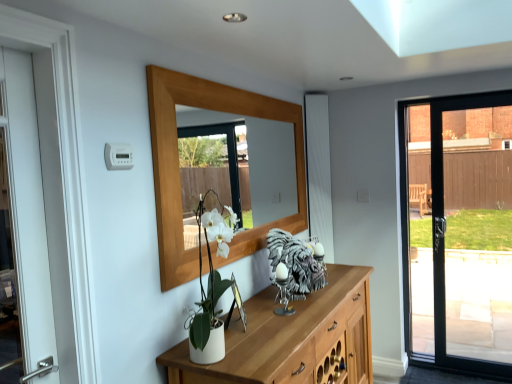
Question: From the image's perspective, is shiny silver sculpture at center beneath wooden mirror at upper center?

Choices:
 (A) no
 (B) yes

Answer: (B)

Question: Is shiny silver sculpture at center closer to camera compared to wooden mirror at upper center?

Choices:
 (A) yes
 (B) no

Answer: (B)

Question: Does shiny silver sculpture at center contain wooden mirror at upper center?

Choices:
 (A) no
 (B) yes

Answer: (A)

Question: Can you confirm if shiny silver sculpture at center is wider than wooden mirror at upper center?

Choices:
 (A) yes
 (B) no

Answer: (A)

Question: Is shiny silver sculpture at center touching wooden mirror at upper center?

Choices:
 (A) yes
 (B) no

Answer: (B)

Question: Is shiny silver sculpture at center located outside wooden mirror at upper center?

Choices:
 (A) yes
 (B) no

Answer: (A)

Question: Is wooden mirror at upper center further to the viewer compared to shiny silver sculpture at center?

Choices:
 (A) yes
 (B) no

Answer: (B)

Question: Is wooden mirror at upper center smaller than shiny silver sculpture at center?

Choices:
 (A) no
 (B) yes

Answer: (A)

Question: Does wooden mirror at upper center have a lesser width compared to shiny silver sculpture at center?

Choices:
 (A) yes
 (B) no

Answer: (A)

Question: Is wooden mirror at upper center touching shiny silver sculpture at center?

Choices:
 (A) yes
 (B) no

Answer: (B)

Question: Does wooden mirror at upper center appear on the left side of shiny silver sculpture at center?

Choices:
 (A) yes
 (B) no

Answer: (A)

Question: Does wooden mirror at upper center have a larger size compared to shiny silver sculpture at center?

Choices:
 (A) yes
 (B) no

Answer: (A)

Question: Is wooden mirror at upper center shorter than metallic silver picture frame at center?

Choices:
 (A) yes
 (B) no

Answer: (B)